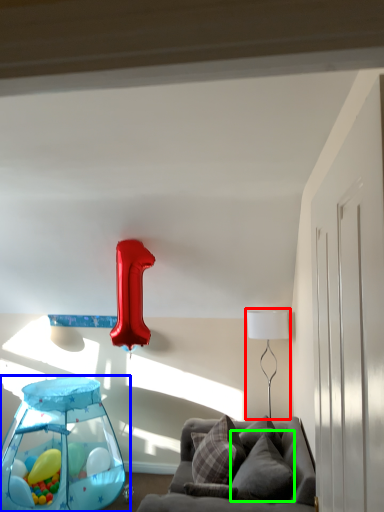
Question: Estimate the real-world distances between objects in this image. Which object is closer to table lamp (highlighted by a red box), baby carriage (highlighted by a blue box) or pillow (highlighted by a green box)?

Choices:
 (A) baby carriage
 (B) pillow

Answer: (B)